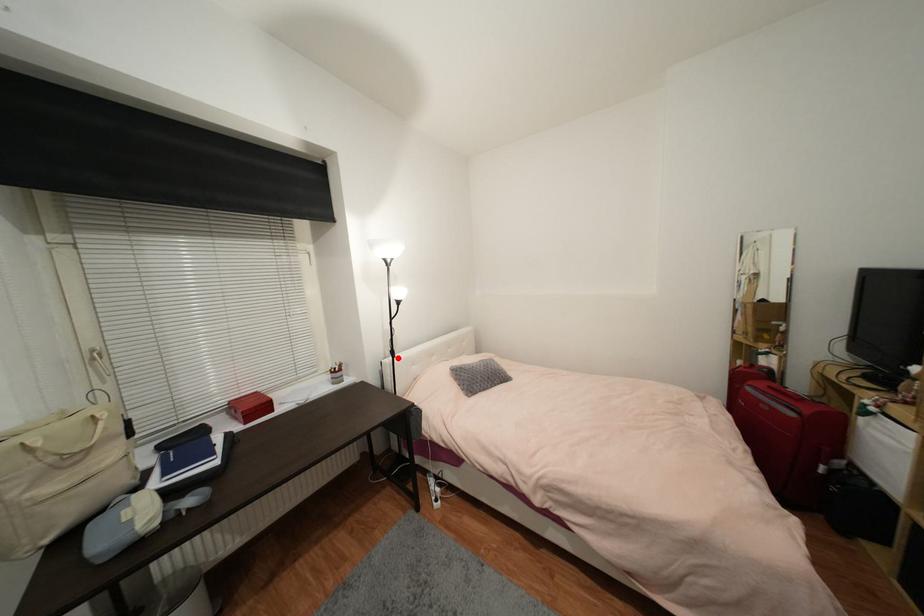
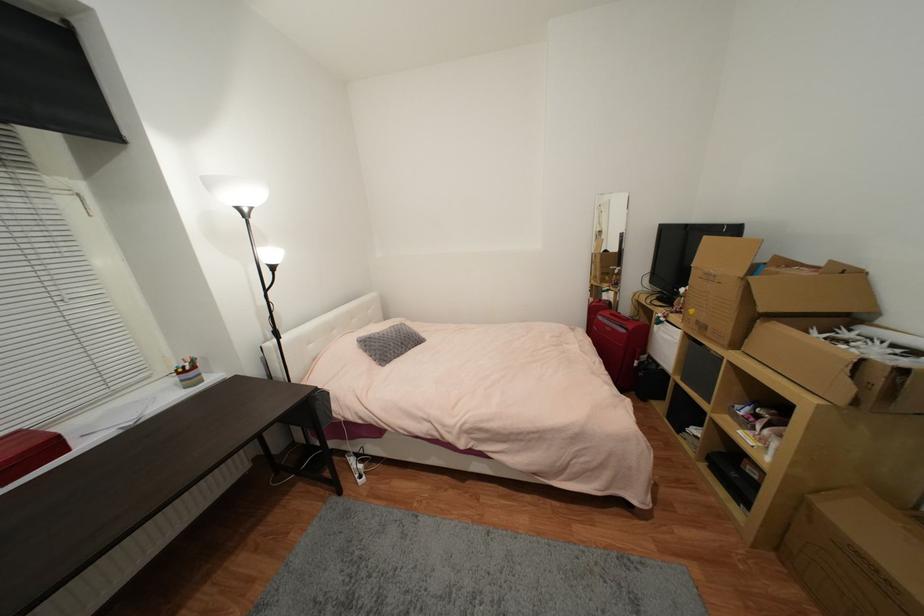
Where in the second image is the point corresponding to the highlighted location from the first image?

(283, 339)